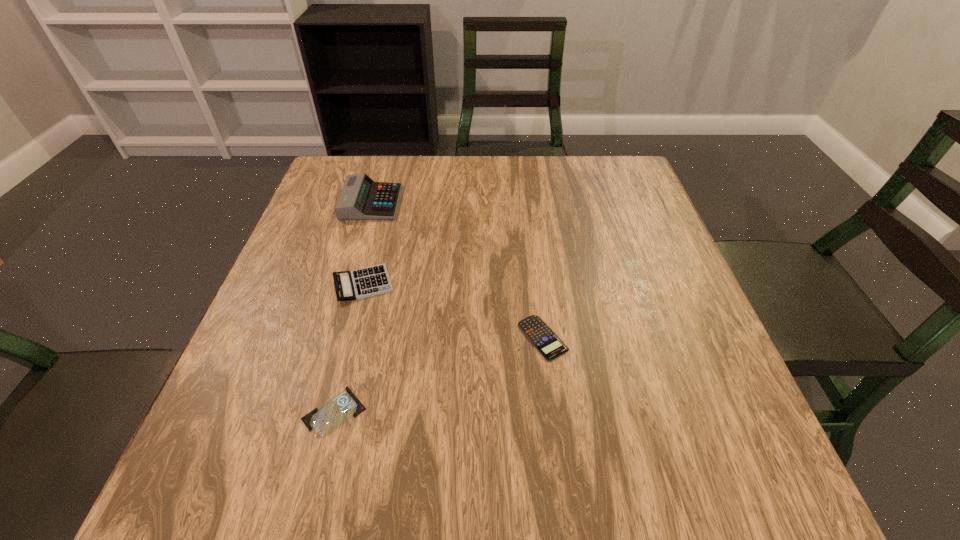
The height and width of the screenshot is (540, 960). I want to click on the farthest object, so click(361, 198).

In order to click on the tallest calculator in this screenshot , I will do `click(361, 198)`.

Identify the location of the third nearest object. (349, 285).

This screenshot has height=540, width=960. I want to click on the third shortest object, so click(x=349, y=285).

At what (x,y) coordinates should I click in order to perform the action: click on the second nearest object. Please return your answer as a coordinate pair (x, y). The width and height of the screenshot is (960, 540). Looking at the image, I should click on (550, 346).

Identify the location of the rightmost object. (550, 346).

The image size is (960, 540). Find the location of `the shortest object`. the shortest object is located at coordinates (323, 421).

The height and width of the screenshot is (540, 960). In order to click on identity card in this screenshot , I will do `click(323, 421)`.

Where is `vacant space situated on the right of the farthest calculator`? The image size is (960, 540). vacant space situated on the right of the farthest calculator is located at coordinates (549, 202).

The width and height of the screenshot is (960, 540). What are the coordinates of `vacant space located on the back of the third shortest object` in the screenshot? It's located at (389, 185).